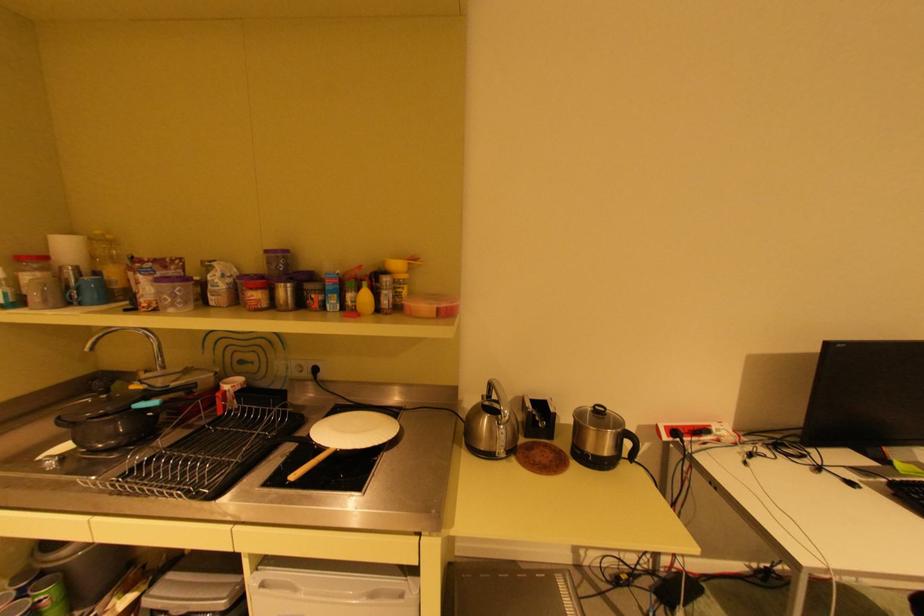
Find the location of a particular element. faucet handle is located at coordinates (131, 342).